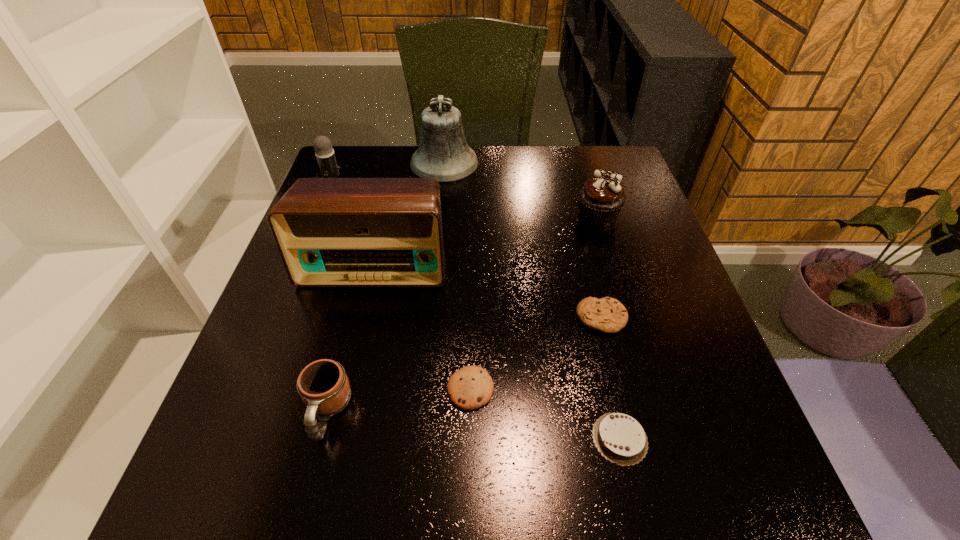
At what (x,y) coordinates should I click in order to perform the action: click on microphone present at the far edge. Please return your answer as a coordinate pair (x, y). The image size is (960, 540). Looking at the image, I should click on (325, 155).

I want to click on object at the near edge, so click(620, 438).

Where is `radio receiver that is at the left edge`? radio receiver that is at the left edge is located at coordinates (330, 232).

I want to click on microphone located at the left edge, so click(325, 155).

You are a GUI agent. You are given a task and a screenshot of the screen. Output one action in this format:
    pyautogui.click(x=<x>, y=<y>)
    Task: Click on the mug that is at the left edge
    
    Given the screenshot: What is the action you would take?
    pyautogui.click(x=323, y=385)

This screenshot has height=540, width=960. In order to click on cupcake that is at the right edge in this screenshot , I will do `click(601, 198)`.

I want to click on cookie at the right edge, so click(x=608, y=315).

The height and width of the screenshot is (540, 960). I want to click on chocolate cake located in the right edge section of the desktop, so click(620, 438).

At what (x,y) coordinates should I click in order to perform the action: click on object positioned at the far left corner. Please return your answer as a coordinate pair (x, y). The height and width of the screenshot is (540, 960). Looking at the image, I should click on (325, 155).

You are a GUI agent. You are given a task and a screenshot of the screen. Output one action in this format:
    pyautogui.click(x=<x>, y=<y>)
    Task: Click on the object located in the near right corner section of the desktop
    The height and width of the screenshot is (540, 960).
    Given the screenshot: What is the action you would take?
    coord(620,438)